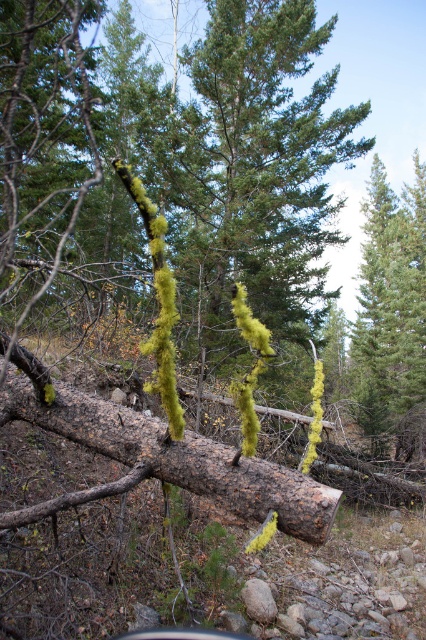
Does rusty bark log at center have a lesser height compared to green lichen-covered tree at right?

Indeed, rusty bark log at center has a lesser height compared to green lichen-covered tree at right.

Is point (204, 468) farther from viewer compared to point (371, 333)?

No.

This screenshot has height=640, width=426. What do you see at coordinates (176, 458) in the screenshot? I see `rusty bark log at center` at bounding box center [176, 458].

The height and width of the screenshot is (640, 426). I want to click on rusty bark log at center, so click(x=176, y=458).